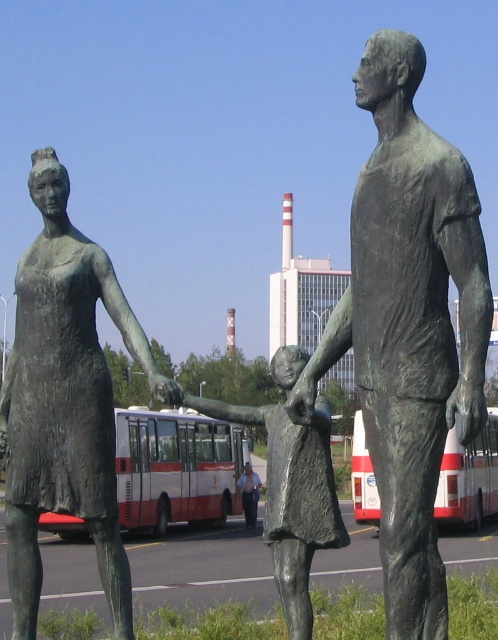
Who is more distant from viewer, [371,236] or [182,417]?

Point [182,417]

Who is lower down, bronze statue at center or white matte bus at center?

white matte bus at center

Which is in front, point (397, 182) or point (131, 499)?

Point (397, 182) is more forward.

Where is `bronze statue at center`? Image resolution: width=498 pixels, height=640 pixels. bronze statue at center is located at coordinates (408, 324).

Which of these two, white matte bus at center or light blue shirt at center, stands taller?

With more height is white matte bus at center.

Measure the distance between point (199,492) and camera.

Point (199,492) and camera are 129.69 feet apart.

Which is in front, point (204, 504) or point (254, 492)?

Point (204, 504)

You are a GUI agent. You are given a task and a screenshot of the screen. Output one action in this format:
    pyautogui.click(x=<x>, y=<y>)
    Task: Click on the white matte bus at center
    The width and height of the screenshot is (498, 640).
    Given the screenshot: What is the action you would take?
    pyautogui.click(x=175, y=468)

Is point (405, 609) closer to camera compared to point (478, 461)?

Yes.

Between point (382, 464) and point (484, 492), which one is positioned in front?

Point (382, 464)

Identify the location of bronze statue at center. The image size is (498, 640). (408, 324).